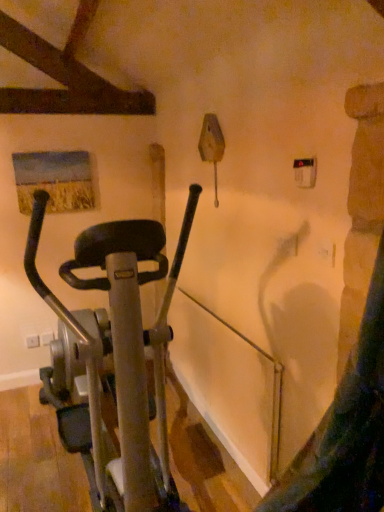
What do you see at coordinates (113, 356) in the screenshot?
I see `silver metallic stationary bicycle at left` at bounding box center [113, 356].

Identify the location of silver metallic stationary bicycle at left. This screenshot has width=384, height=512. (113, 356).

This screenshot has width=384, height=512. Identify the location of silver metallic stationary bicycle at left. (113, 356).